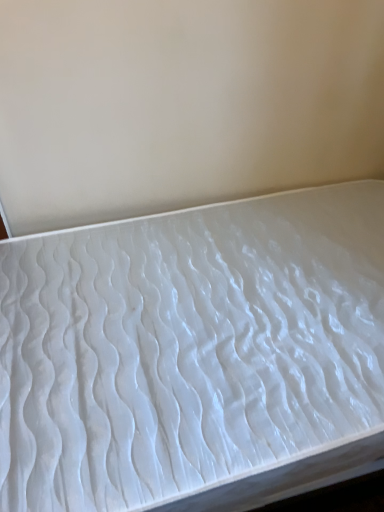
Where is `white textured mattress at center`? This screenshot has width=384, height=512. white textured mattress at center is located at coordinates (194, 354).

Image resolution: width=384 pixels, height=512 pixels. Describe the element at coordinates (194, 354) in the screenshot. I see `white textured mattress at center` at that location.

Locate an element on the screen. white textured mattress at center is located at coordinates tap(194, 354).